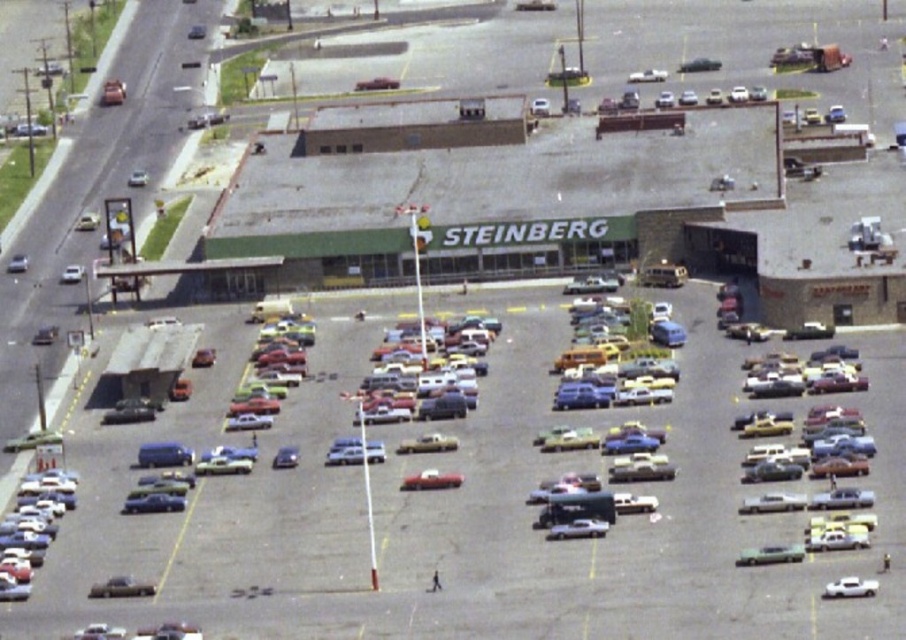
You are a delivery person trying to park your van in this parking lot. You notice two vans already parked here. Which van is taller between the metallic blue van at lower left and the metallic silver van at center?

The metallic blue van at lower left is taller than the metallic silver van at center.

You are standing at the center of the parking lot and want to find the metallic silver car at lower right. According to the coordinates provided, in which direction should you walk to reach it?

The metallic silver car at lower right is located at coordinates (770, 554), which means you should walk towards the lower right direction from the center to reach it.